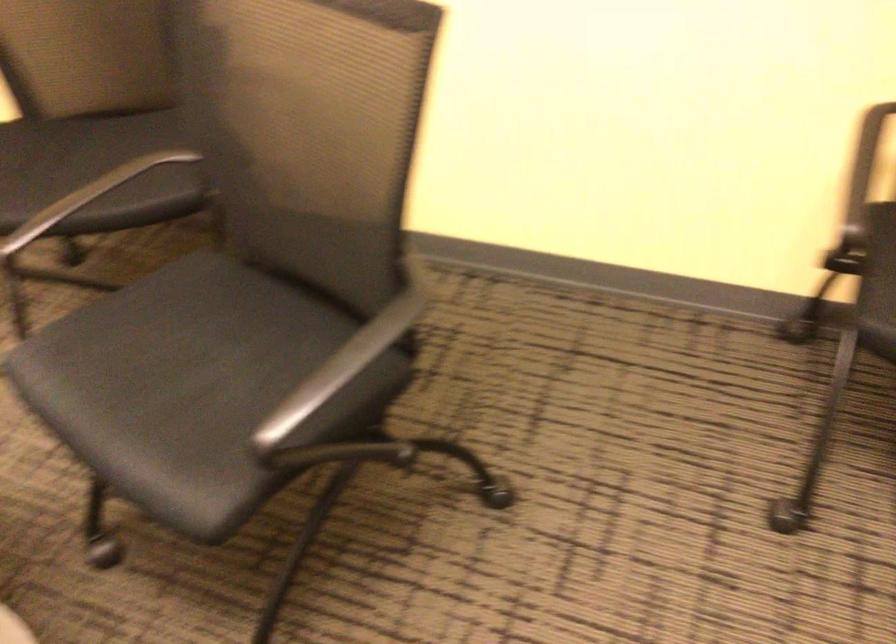
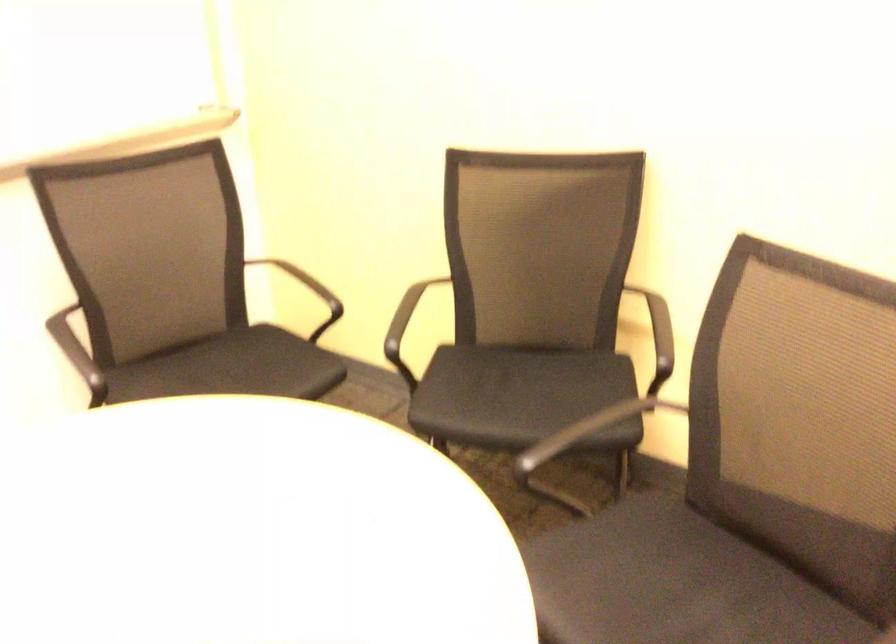
Question: The camera is either moving clockwise (left) or counter-clockwise (right) around the object. The first image is from the beginning of the video and the second image is from the end. Is the camera moving left or right when shooting the video?

Choices:
 (A) Left
 (B) Right

Answer: (B)